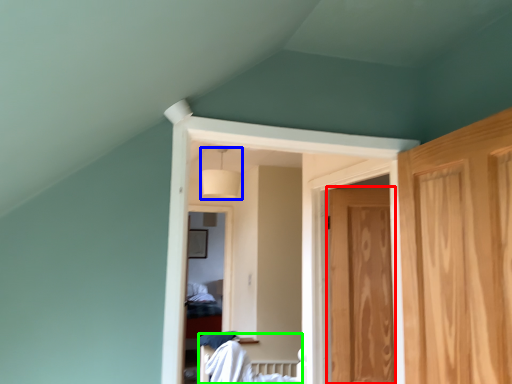
Question: Which object is positioned closest to door (highlighted by a red box)? Select from lamp (highlighted by a blue box) and bed (highlighted by a green box).

Choices:
 (A) lamp
 (B) bed

Answer: (B)